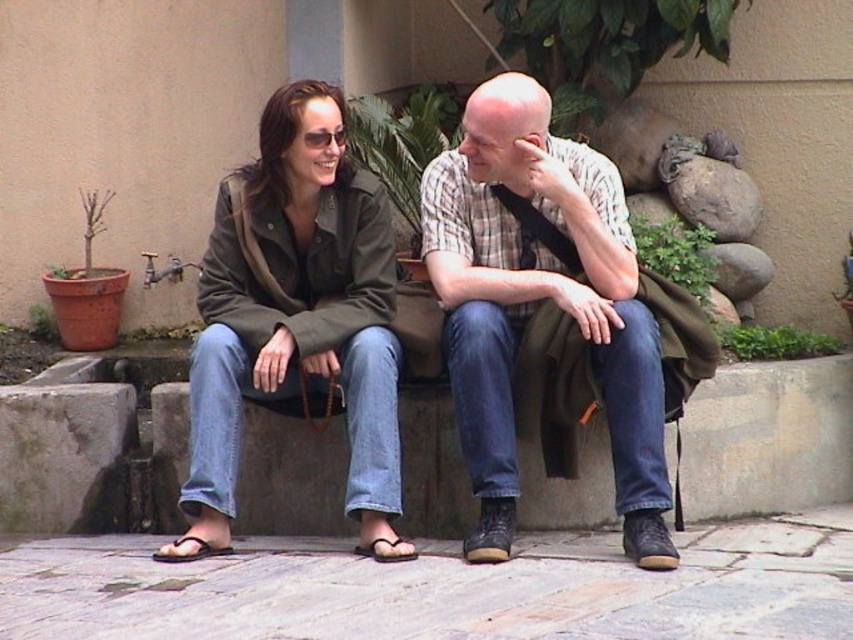
You are a photographer trying to capture both the matte plaid shirt at center and the purple fabric sandal at lower left in a single shot. Which object should you focus on first to ensure both are in frame?

The matte plaid shirt at center is bigger than the purple fabric sandal at lower left, so you should focus on the matte plaid shirt at center first to ensure both are in frame.

You are standing at the origin of a coordinate system placed at the bottom left corner of the image. You see a point labeled at coordinates (538, 301). What object is located at that point?

The point at coordinates (538, 301) marks the location of the matte plaid shirt at center.

You are a delivery person who needs to place a small package between the brown leather sandal at lower center and the purple fabric sandal at lower left. The package is 12 inches long. Can you fit it between them?

The distance between the brown leather sandal at lower center and the purple fabric sandal at lower left is 27.86 inches, so yes, the 12 inch package can fit between them.